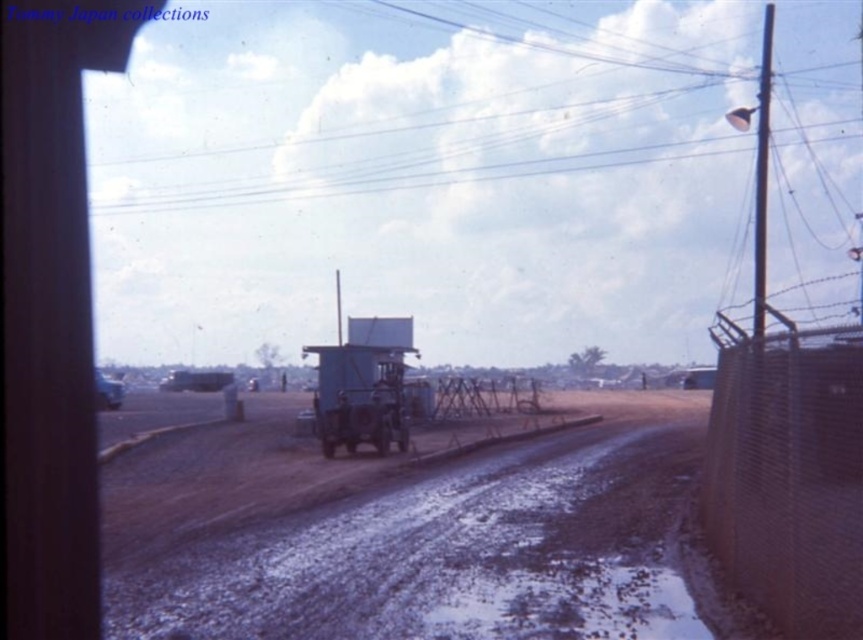
Question: Can you confirm if brown dirt track at center is positioned to the left of rusty wire mesh fence at right?

Choices:
 (A) no
 (B) yes

Answer: (B)

Question: Which point appears farthest from the camera in this image?

Choices:
 (A) (316, 465)
 (B) (855, 396)

Answer: (A)

Question: Can you confirm if brown dirt track at center is positioned to the left of rusty wire mesh fence at right?

Choices:
 (A) no
 (B) yes

Answer: (B)

Question: Does brown dirt track at center appear under rusty wire mesh fence at right?

Choices:
 (A) yes
 (B) no

Answer: (A)